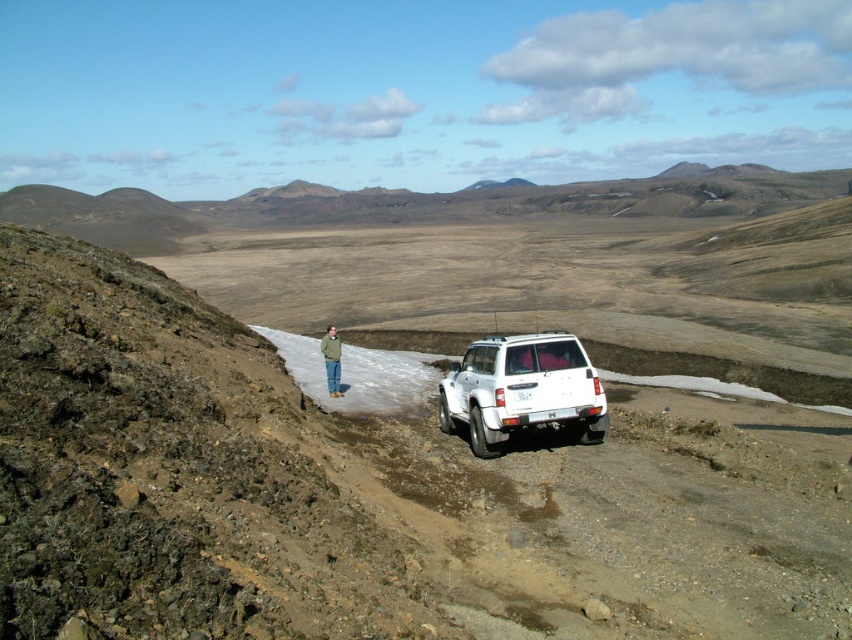
Is point (517, 387) positioned before point (335, 365)?

Yes, it is.

What do you see at coordinates (522, 388) in the screenshot? I see `white matte suv at center` at bounding box center [522, 388].

Identify the location of white matte suv at center. (522, 388).